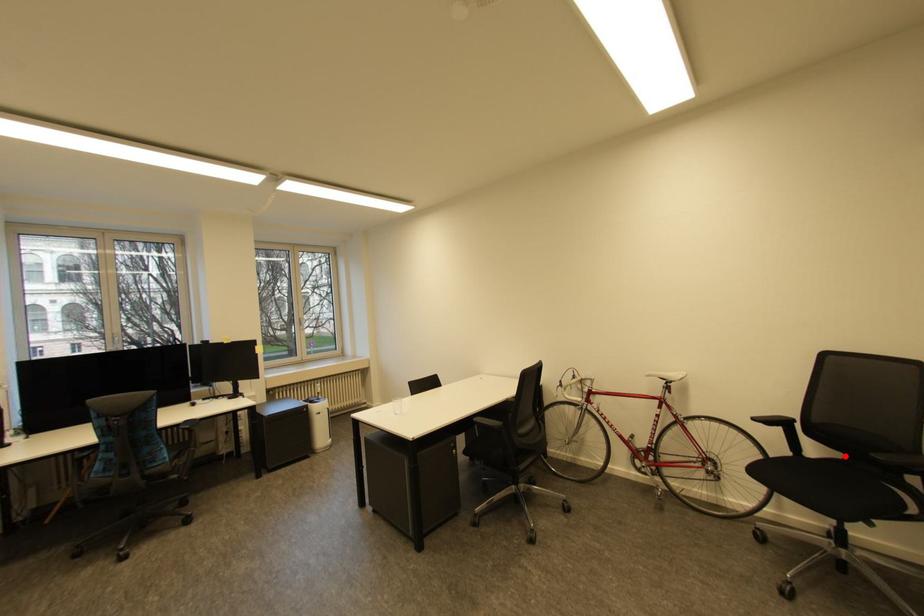
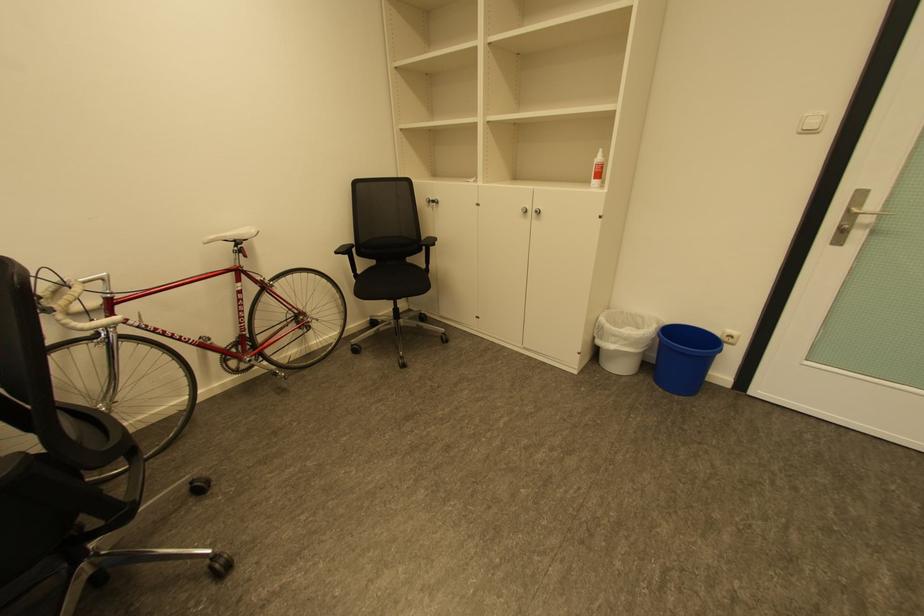
Find the pixel in the second image that matches the highlighted location in the first image.

(380, 262)